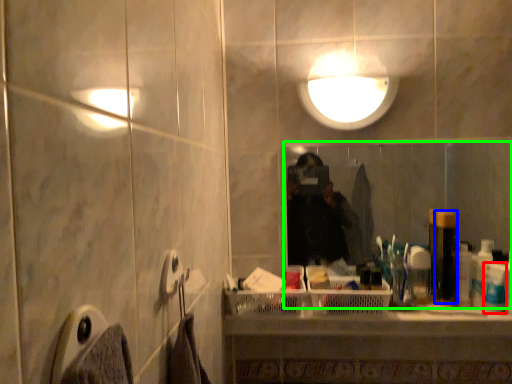
Question: Which object is the closest to the toiletry (highlighted by a red box)? Choose among these: toiletry (highlighted by a blue box) or mirror (highlighted by a green box).

Choices:
 (A) toiletry
 (B) mirror

Answer: (A)